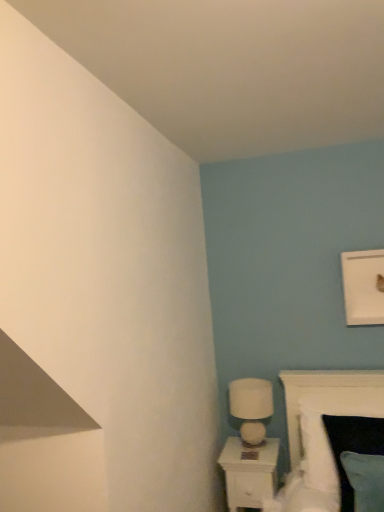
Question: Is white glossy nightstand at lower right far away from white glossy table lamp at lower right?

Choices:
 (A) yes
 (B) no

Answer: (B)

Question: From the image's perspective, does white glossy nightstand at lower right appear higher than white glossy table lamp at lower right?

Choices:
 (A) no
 (B) yes

Answer: (A)

Question: Is white glossy nightstand at lower right aimed at white glossy table lamp at lower right?

Choices:
 (A) yes
 (B) no

Answer: (B)

Question: Does white glossy nightstand at lower right touch white glossy table lamp at lower right?

Choices:
 (A) no
 (B) yes

Answer: (A)

Question: Does white glossy nightstand at lower right have a greater width compared to white glossy table lamp at lower right?

Choices:
 (A) yes
 (B) no

Answer: (A)

Question: Is white glossy nightstand at lower right at the right side of white glossy table lamp at lower right?

Choices:
 (A) yes
 (B) no

Answer: (B)

Question: Can you confirm if white glossy table lamp at lower right is shorter than white glossy nightstand at lower right?

Choices:
 (A) no
 (B) yes

Answer: (B)

Question: From the image's perspective, is white glossy table lamp at lower right above white glossy nightstand at lower right?

Choices:
 (A) no
 (B) yes

Answer: (B)

Question: Does white glossy table lamp at lower right lie in front of white glossy nightstand at lower right?

Choices:
 (A) no
 (B) yes

Answer: (A)

Question: Can you confirm if white glossy table lamp at lower right is wider than white glossy nightstand at lower right?

Choices:
 (A) yes
 (B) no

Answer: (B)

Question: Can you see white glossy table lamp at lower right touching white glossy nightstand at lower right?

Choices:
 (A) no
 (B) yes

Answer: (A)

Question: Could you tell me if white glossy table lamp at lower right is turned towards white glossy nightstand at lower right?

Choices:
 (A) no
 (B) yes

Answer: (A)

Question: Considering the relative sizes of white glossy nightstand at lower right and white soft bed at lower right in the image provided, is white glossy nightstand at lower right thinner than white soft bed at lower right?

Choices:
 (A) no
 (B) yes

Answer: (B)